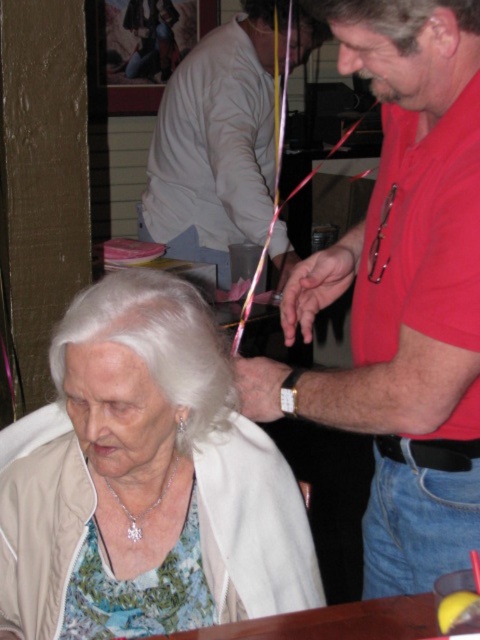
Which is more to the right, red shirt at right or brown wooden table at lower center?

red shirt at right

Which is in front, point (382, 333) or point (416, 627)?

Point (416, 627)

Find the location of a particular element. red shirt at right is located at coordinates (403, 292).

This screenshot has width=480, height=640. What are the coordinates of `red shirt at right` in the screenshot? It's located at (403, 292).

Between point (420, 278) and point (466, 22), which one is positioned behind?

Point (420, 278)

Identify the location of red shirt at right. Image resolution: width=480 pixels, height=640 pixels. (403, 292).

Who is lower down, light beige shirt at center or gray matte hair at upper center?

gray matte hair at upper center is lower down.

Does light beige shirt at center appear under gray matte hair at upper center?

Actually, light beige shirt at center is above gray matte hair at upper center.

Locate an element on the screen. light beige shirt at center is located at coordinates (216, 141).

Find the location of `light beige shirt at center`. light beige shirt at center is located at coordinates (216, 141).